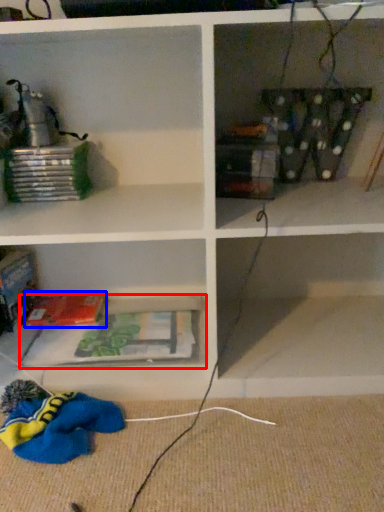
Question: Which object appears farthest to the camera in this image, cabinet (highlighted by a red box) or paperback book (highlighted by a blue box)?

Choices:
 (A) cabinet
 (B) paperback book

Answer: (B)